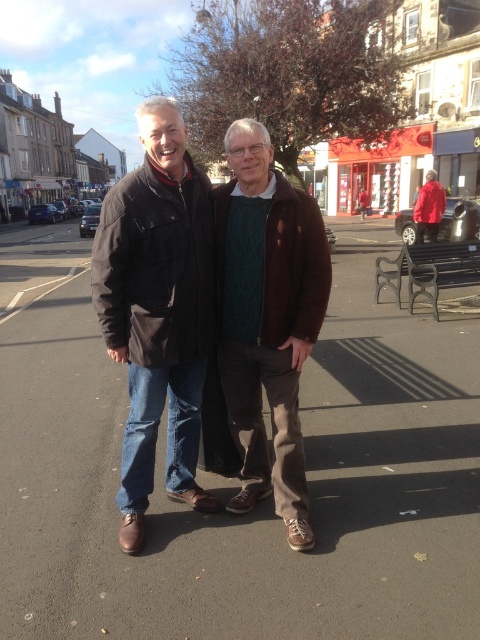
Which of these two, dark brown leather jacket at center or brown suede jacket at center, stands shorter?

brown suede jacket at center is shorter.

Looking at this image, between dark brown leather jacket at center and brown suede jacket at center, which one appears on the right side from the viewer's perspective?

brown suede jacket at center is more to the right.

Is point (327, 266) positioned after point (264, 433)?

No, it is not.

What are the coordinates of `dark brown leather jacket at center` in the screenshot? It's located at (157, 308).